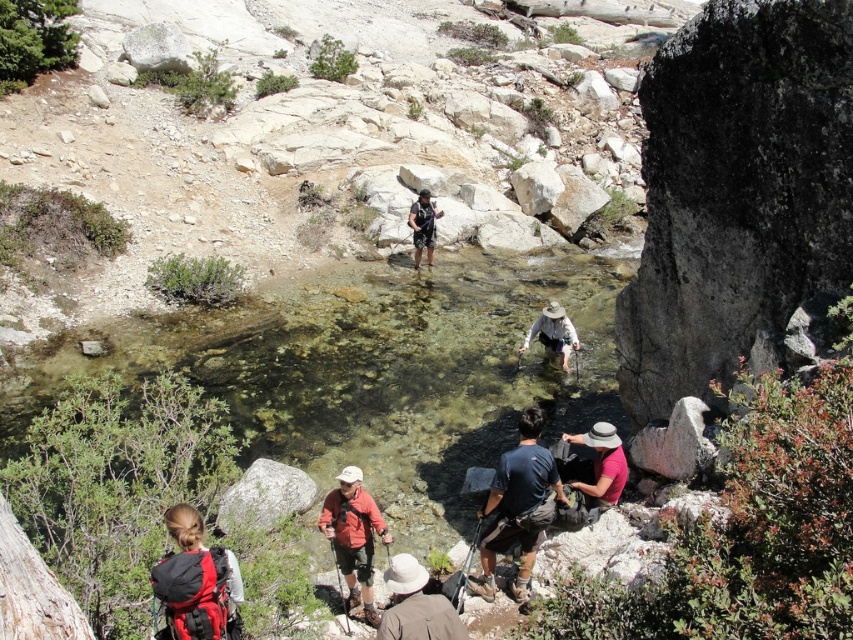
Question: Does smooth gray rock at lower left appear on the right side of brown canvas backpack at lower center?

Choices:
 (A) no
 (B) yes

Answer: (A)

Question: Which of these objects is positioned closest to the black mesh shirt at center?

Choices:
 (A) dark blue t-shirt at center
 (B) brown canvas backpack at lower center

Answer: (A)

Question: Does white fabric hat at center have a lesser width compared to black mesh shirt at center?

Choices:
 (A) yes
 (B) no

Answer: (B)

Question: Can you confirm if dark blue t-shirt at center is smaller than orange fabric backpack at lower center?

Choices:
 (A) yes
 (B) no

Answer: (B)

Question: Among these points, which one is farthest from the camera?

Choices:
 (A) (535, 326)
 (B) (480, 515)

Answer: (A)

Question: Considering the real-world distances, which object is farthest from the brown canvas backpack at lower center?

Choices:
 (A) orange fabric backpack at lower center
 (B) black mesh shirt at center
 (C) dark blue t-shirt at center
 (D) red backpack at lower left

Answer: (B)